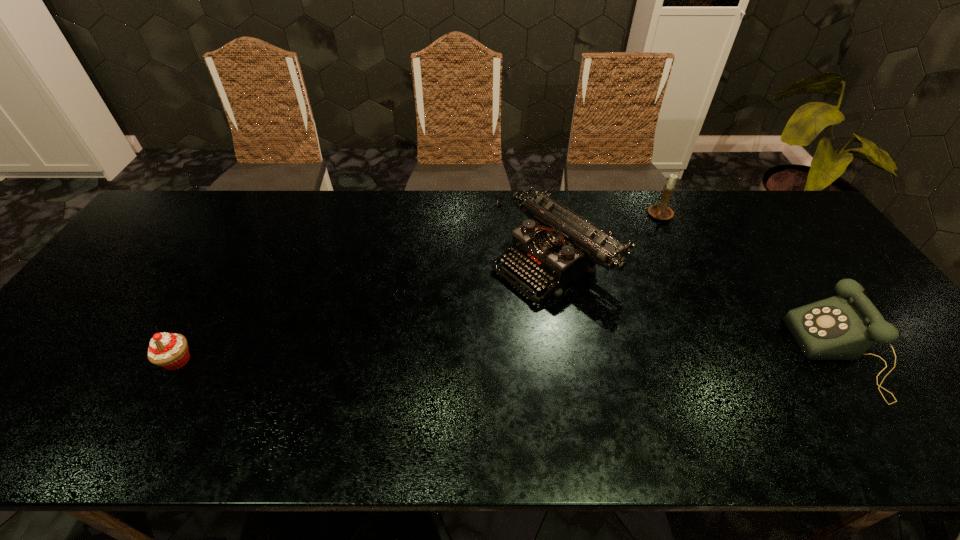
Where is `free space on the desktop that is between the shortest object and the telephone and is positioned on the side of the candle holder with the handle`? free space on the desktop that is between the shortest object and the telephone and is positioned on the side of the candle holder with the handle is located at coordinates (550, 357).

This screenshot has width=960, height=540. Identify the location of free space on the desktop that is between the cupcake and the rightmost object and is positioned on the keyboard of the typewriter. (412, 358).